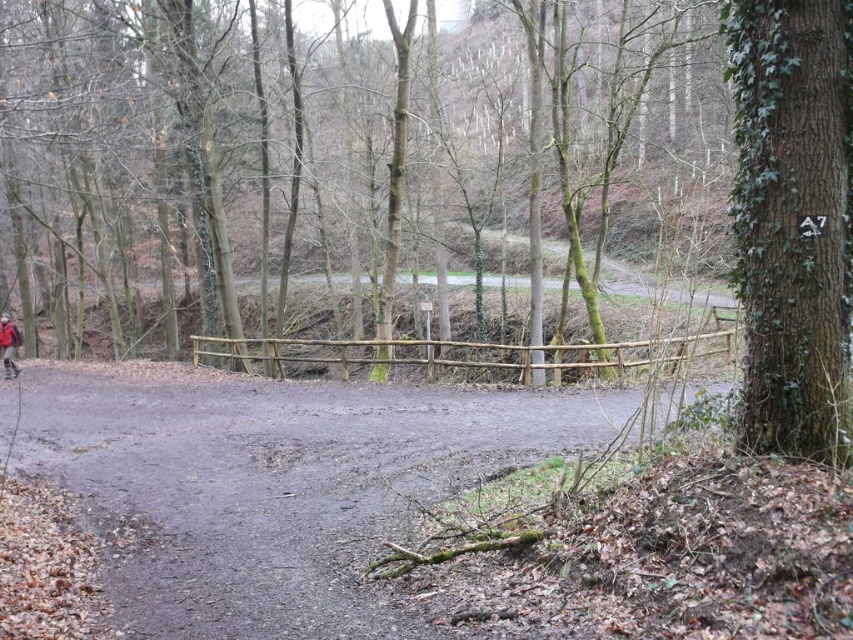
You are standing on the dirt path in the wooded area. You see a point marked at coordinates (793, 220). What object is located at that point?

The point at coordinates (793, 220) corresponds to the green ivycovered tree at right.